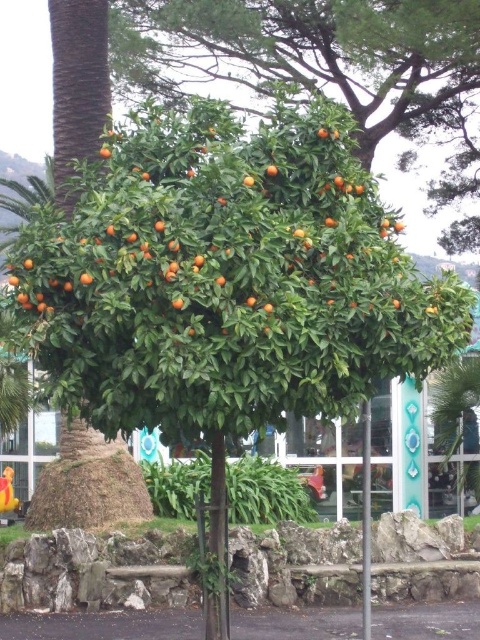
You are a gardener standing in front of the green leafy tree at center and the metallic pole at center. Which object would cast a larger shadow during midday when the sun is directly overhead?

The green leafy tree at center is bigger than the metallic pole at center, so it would cast a larger shadow during midday when the sun is directly overhead.

You are standing at the point labeled point (310, 54) in the image. What object are you facing?

You are facing the green leafy tree at center.

In the scene shown: You are standing at point A, which is located at coordinates (x=456, y=406). You want to move towards the vibrant orange tree. Is the green leafy palm tree at center blocking your path?

The green leafy palm tree at center is located at point A, so it is blocking your path to the vibrant orange tree.